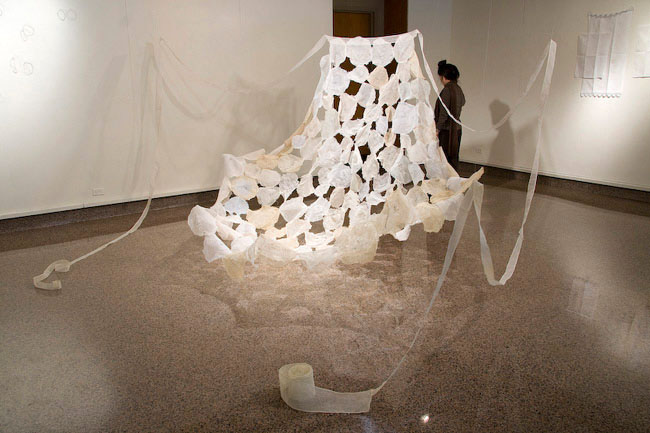
Where is `wall`? Image resolution: width=650 pixels, height=433 pixels. wall is located at coordinates (560, 126).